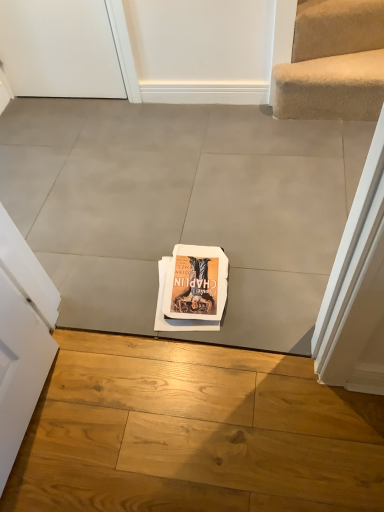
Question: Is point (261, 268) positioned closer to the camera than point (13, 52)?

Choices:
 (A) farther
 (B) closer

Answer: (B)

Question: Would you say gray concrete at center, the 2th concrete positioned from the front, is inside or outside white matte door at upper left?

Choices:
 (A) outside
 (B) inside

Answer: (A)

Question: Which object is positioned farthest from the white matte door at upper left?

Choices:
 (A) matte paper book at center
 (B) gray tile floor at center, the 2th concrete from the back
 (C) gray concrete at center, arranged as the first concrete when viewed from the top

Answer: (B)

Question: Estimate the real-world distances between objects in this image. Which object is farther from the gray tile floor at center, the second concrete in the top-to-bottom sequence?

Choices:
 (A) matte paper book at center
 (B) gray concrete at center, arranged as the first concrete when viewed from the top
 (C) white matte door at upper left

Answer: (C)